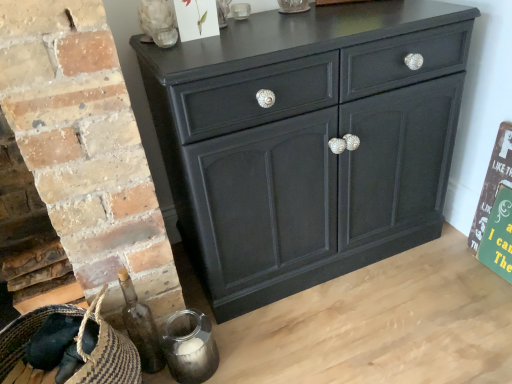
You are a GUI agent. You are given a task and a screenshot of the screen. Output one action in this format:
    pyautogui.click(x=<x>, y=<y>)
    Task: Click on the vacant area that lies to the right of transparent glass skull at upper left
    
    Given the screenshot: What is the action you would take?
    pyautogui.click(x=227, y=29)